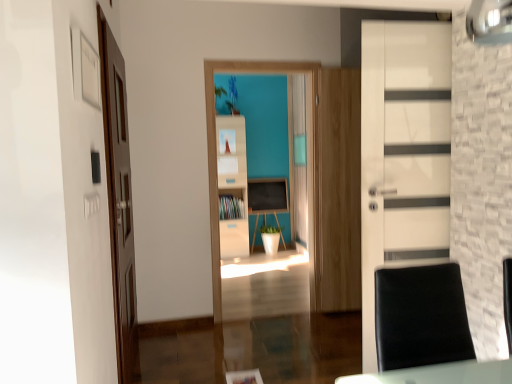
Question: Is point (364, 254) positioned closer to the camera than point (216, 296)?

Choices:
 (A) closer
 (B) farther

Answer: (A)

Question: In terms of width, does white glossy door at right, the second door when ordered from left to right, look wider or thinner when compared to white matte bookshelf at center?

Choices:
 (A) thin
 (B) wide

Answer: (B)

Question: Which is farther from the matte black chalkboard at center?

Choices:
 (A) white matte bookshelf at center
 (B) white glossy door at right, which is counted as the 1th door, starting from the right
 (C) black leather swivel chair at lower right
 (D) green matte plant at center
 (E) matte wood cabinet at center

Answer: (C)

Question: Which object is the farthest from the matte black chalkboard at center?

Choices:
 (A) white glossy door at right, the second door when ordered from left to right
 (B) green matte plant at center
 (C) brown wooden door at left, which ranks as the second door in right-to-left order
 (D) white matte bookshelf at center
 (E) black leather swivel chair at lower right

Answer: (E)